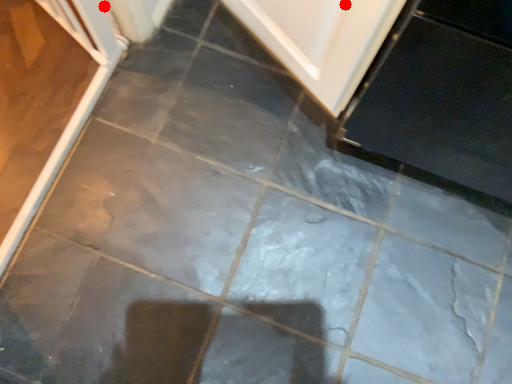
Question: Two points are circled on the image, labeled by A and B beside each circle. Which point appears farthest from the camera in this image?

Choices:
 (A) A is further
 (B) B is further

Answer: (B)